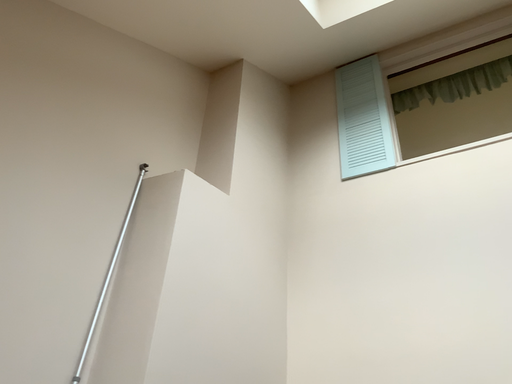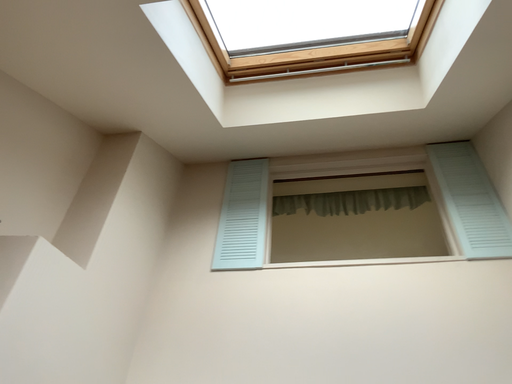
Question: Which way did the camera rotate in the video?

Choices:
 (A) rotated downward
 (B) rotated upward

Answer: (B)